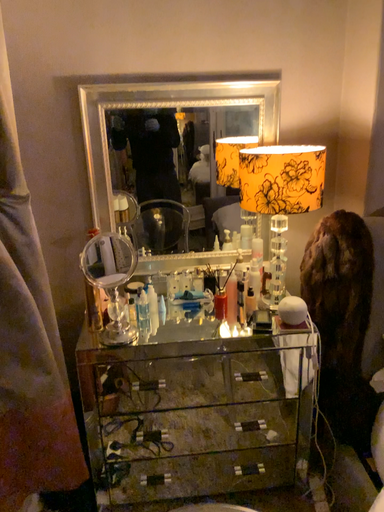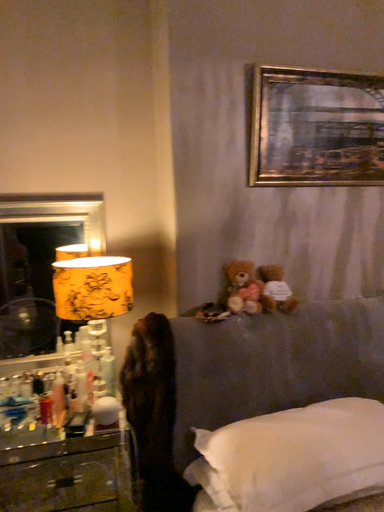
Question: Which way did the camera rotate in the video?

Choices:
 (A) rotated right
 (B) rotated left

Answer: (A)